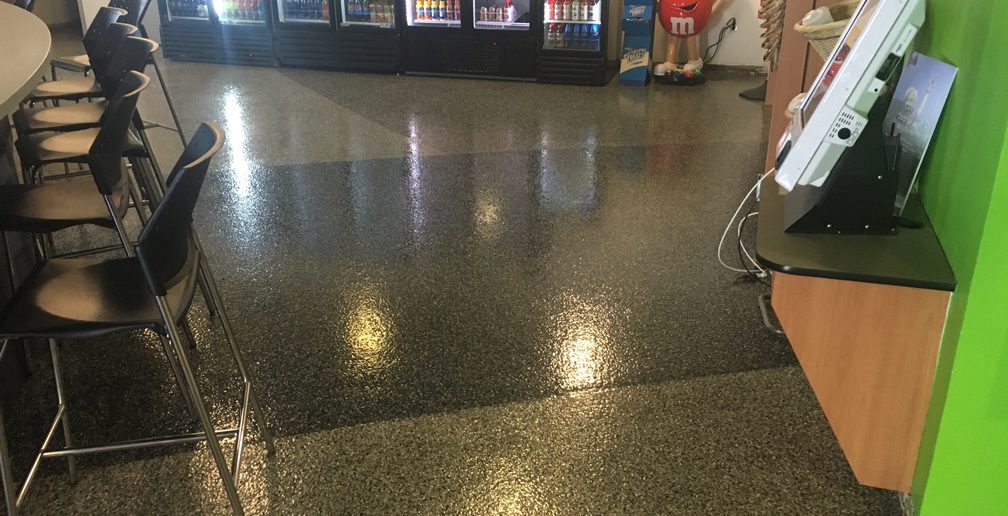
Image resolution: width=1008 pixels, height=516 pixels. What are the coordinates of `lighter areas of tile floor` in the screenshot? It's located at (686, 479), (466, 106).